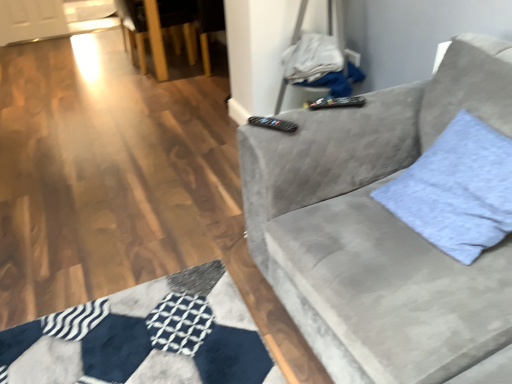
Describe the element at coordinates (379, 228) in the screenshot. This screenshot has height=384, width=512. I see `velvet gray couch at right` at that location.

Identify the location of velvet gray couch at right. (379, 228).

In order to face wooden armchair at upper left, should I rotate leftwards or rightwards?

Turn left by 10.136 degrees to look at wooden armchair at upper left.

Where is `black plastic remote at upper center, which ranks as the second remote in bottom-to-top order`? The height and width of the screenshot is (384, 512). black plastic remote at upper center, which ranks as the second remote in bottom-to-top order is located at coordinates (336, 102).

From a real-world perspective, is light blue fabric pillow at right physically located above or below velvet gray couch at right?

In terms of real-world spatial position, light blue fabric pillow at right is above velvet gray couch at right.

Considering the relative sizes of light blue fabric pillow at right and velvet gray couch at right in the image provided, is light blue fabric pillow at right shorter than velvet gray couch at right?

Yes.

Identify the location of studio couch in front of the light blue fabric pillow at right. (379, 228).

Is velvet gray couch at right completely or partially inside light blue fabric pillow at right?

No, velvet gray couch at right is not a part of light blue fabric pillow at right.

From a real-world perspective, is black plastic remote at upper center, which appears as the 1th remote when viewed from the top, under wooden armchair at upper left?

No, from a real-world perspective, black plastic remote at upper center, which appears as the 1th remote when viewed from the top, is not below wooden armchair at upper left.

Is black plastic remote at upper center, which appears as the 1th remote when viewed from the back, in front of or behind wooden armchair at upper left in the image?

Clearly, black plastic remote at upper center, which appears as the 1th remote when viewed from the back, is in front of wooden armchair at upper left.

Which of these two, black plastic remote at upper center, which appears as the 1th remote when viewed from the back, or wooden armchair at upper left, is wider?

wooden armchair at upper left.

Is black plastic remote at upper center, placed as the 1th remote when sorted from right to left, directly adjacent to wooden armchair at upper left?

No, black plastic remote at upper center, placed as the 1th remote when sorted from right to left, is not making contact with wooden armchair at upper left.

Is black plastic remote at upper center, the 1th remote viewed from the front, to the left of light blue fabric pillow at right from the viewer's perspective?

Yes.

Would you consider black plastic remote at upper center, positioned as the 1th remote in left-to-right order, to be distant from light blue fabric pillow at right?

black plastic remote at upper center, positioned as the 1th remote in left-to-right order, is actually quite close to light blue fabric pillow at right.

In the scene shown: Which object is further away from the camera, black plastic remote at upper center, arranged as the 2th remote when viewed from the top, or light blue fabric pillow at right?

black plastic remote at upper center, arranged as the 2th remote when viewed from the top, is further away from the camera.

From the image's perspective, does black plastic remote at upper center, the 1th remote viewed from the front, appear higher than light blue fabric pillow at right?

Yes.

Is wooden armchair at upper left facing away from velvet gray couch at right?

No, wooden armchair at upper left's orientation is not away from velvet gray couch at right.

Can you confirm if wooden armchair at upper left is shorter than velvet gray couch at right?

Indeed, wooden armchair at upper left has a lesser height compared to velvet gray couch at right.

In the scene shown: Which of these two, wooden armchair at upper left or velvet gray couch at right, is wider?

With larger width is velvet gray couch at right.

Between velvet gray couch at right and black plastic remote at upper center, which ranks as the second remote in front-to-back order, which one has less height?

black plastic remote at upper center, which ranks as the second remote in front-to-back order, is shorter.

Based on their sizes in the image, would you say velvet gray couch at right is bigger or smaller than black plastic remote at upper center, which ranks as the second remote in bottom-to-top order?

In the image, velvet gray couch at right appears to be larger than black plastic remote at upper center, which ranks as the second remote in bottom-to-top order.

Based on the photo, would you say velvet gray couch at right is to the left or to the right of black plastic remote at upper center, the second remote when ordered from left to right, in the picture?

Based on their positions, velvet gray couch at right is located to the right of black plastic remote at upper center, the second remote when ordered from left to right.

Between light blue fabric pillow at right and black plastic remote at upper center, arranged as the 2th remote when viewed from the top, which one has larger size?

light blue fabric pillow at right is bigger.

Which is more to the left, light blue fabric pillow at right or black plastic remote at upper center, which is the 2th remote in back-to-front order?

black plastic remote at upper center, which is the 2th remote in back-to-front order.

Looking at their sizes, would you say light blue fabric pillow at right is wider or thinner than black plastic remote at upper center, which appears as the 1th remote when ordered from the bottom?

Considering their sizes, light blue fabric pillow at right looks broader than black plastic remote at upper center, which appears as the 1th remote when ordered from the bottom.

In terms of height, does wooden armchair at upper left look taller or shorter compared to black plastic remote at upper center, which is the second remote from right to left?

Clearly, wooden armchair at upper left is taller compared to black plastic remote at upper center, which is the second remote from right to left.

Is wooden armchair at upper left to the left or to the right of black plastic remote at upper center, arranged as the 2th remote when viewed from the top, in the image?

Clearly, wooden armchair at upper left is on the left of black plastic remote at upper center, arranged as the 2th remote when viewed from the top, in the image.

Are wooden armchair at upper left and black plastic remote at upper center, which is the second remote from right to left, beside each other?

No, wooden armchair at upper left is not beside black plastic remote at upper center, which is the second remote from right to left.

I want to click on studio couch that is below the light blue fabric pillow at right (from the image's perspective), so click(379, 228).

Which remote is the 2nd one when counting from the right side of the wooden armchair at upper left? Please provide its 2D coordinates.

[(336, 102)]

From the image, which object appears to be nearer to light blue fabric pillow at right, wooden armchair at upper left or black plastic remote at upper center, which appears as the 1th remote when viewed from the back?

The object closer to light blue fabric pillow at right is black plastic remote at upper center, which appears as the 1th remote when viewed from the back.

Based on their spatial positions, is light blue fabric pillow at right or wooden armchair at upper left further from velvet gray couch at right?

wooden armchair at upper left is further to velvet gray couch at right.

Looking at the image, which one is located further to wooden armchair at upper left, black plastic remote at upper center, which appears as the 1th remote when viewed from the back, or light blue fabric pillow at right?

light blue fabric pillow at right is positioned further to the anchor wooden armchair at upper left.

Based on their spatial positions, is wooden armchair at upper left or velvet gray couch at right further from black plastic remote at upper center, the 1th remote viewed from the front?

The object further to black plastic remote at upper center, the 1th remote viewed from the front, is wooden armchair at upper left.

Looking at the image, which one is located further to wooden armchair at upper left, velvet gray couch at right or light blue fabric pillow at right?

light blue fabric pillow at right lies further to wooden armchair at upper left than the other object.

Looking at the image, which one is located closer to black plastic remote at upper center, which appears as the 1th remote when ordered from the bottom, light blue fabric pillow at right or wooden armchair at upper left?

Based on the image, light blue fabric pillow at right appears to be nearer to black plastic remote at upper center, which appears as the 1th remote when ordered from the bottom.

Estimate the real-world distances between objects in this image. Which object is further from black plastic remote at upper center, positioned as the 1th remote in left-to-right order, black plastic remote at upper center, the second remote when ordered from left to right, or velvet gray couch at right?

The object further to black plastic remote at upper center, positioned as the 1th remote in left-to-right order, is velvet gray couch at right.

Which object lies nearer to the anchor point wooden armchair at upper left, black plastic remote at upper center, positioned as the 1th remote in left-to-right order, or velvet gray couch at right?

Based on the image, velvet gray couch at right appears to be nearer to wooden armchair at upper left.

Identify the location of throw pillow between velvet gray couch at right and black plastic remote at upper center, which ranks as the second remote in front-to-back order, in the front-back direction. 457,190.

Image resolution: width=512 pixels, height=384 pixels. In order to click on remote between light blue fabric pillow at right and black plastic remote at upper center, the second remote when ordered from left to right, in the front-back direction in this screenshot , I will do `click(273, 124)`.

Where is `remote between black plastic remote at upper center, which is the second remote from right to left, and wooden armchair at upper left, along the z-axis`? The width and height of the screenshot is (512, 384). remote between black plastic remote at upper center, which is the second remote from right to left, and wooden armchair at upper left, along the z-axis is located at coordinates (336, 102).

You are a GUI agent. You are given a task and a screenshot of the screen. Output one action in this format:
    pyautogui.click(x=<x>, y=<y>)
    Task: Click on the remote positioned between velvet gray couch at right and black plastic remote at upper center, which ranks as the second remote in front-to-back order, from near to far
    
    Given the screenshot: What is the action you would take?
    pyautogui.click(x=273, y=124)